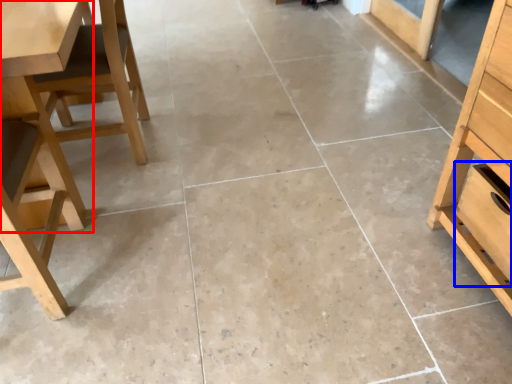
Question: Which of the following is the farthest to the observer, table (highlighted by a red box) or drawer (highlighted by a blue box)?

Choices:
 (A) table
 (B) drawer

Answer: (B)